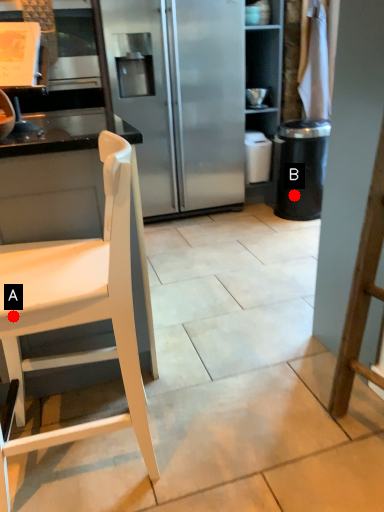
Question: Two points are circled on the image, labeled by A and B beside each circle. Which of the following is the farthest from the observer?

Choices:
 (A) A is further
 (B) B is further

Answer: (B)